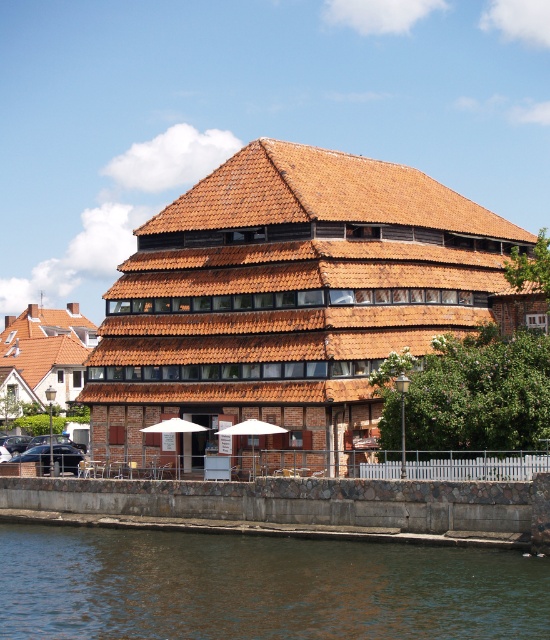
Find the location of `brown water at lower left`. brown water at lower left is located at coordinates (261, 586).

What do you see at coordinates (261, 586) in the screenshot? I see `brown water at lower left` at bounding box center [261, 586].

Where is `brown water at lower left`? The width and height of the screenshot is (550, 640). brown water at lower left is located at coordinates (261, 586).

Measure the distance between point (332, 592) and camera.

Point (332, 592) and camera are 52.40 meters apart.

Image resolution: width=550 pixels, height=640 pixels. What do you see at coordinates (261, 586) in the screenshot? I see `brown water at lower left` at bounding box center [261, 586].

Which is behind, point (469, 545) or point (169, 422)?

The point (169, 422) is behind.

This screenshot has height=640, width=550. What are the coordinates of `brown water at lower left` in the screenshot? It's located at (261, 586).

Can you confirm if white matte umbrella at center is smaller than white fabric umbrella at center?

Yes, white matte umbrella at center is smaller than white fabric umbrella at center.

Does white matte umbrella at center have a lesser height compared to white fabric umbrella at center?

In fact, white matte umbrella at center may be taller than white fabric umbrella at center.

Measure the distance between point (272, 432) and camera.

68.93 meters

Where is `white matte umbrella at center`? white matte umbrella at center is located at coordinates (251, 433).